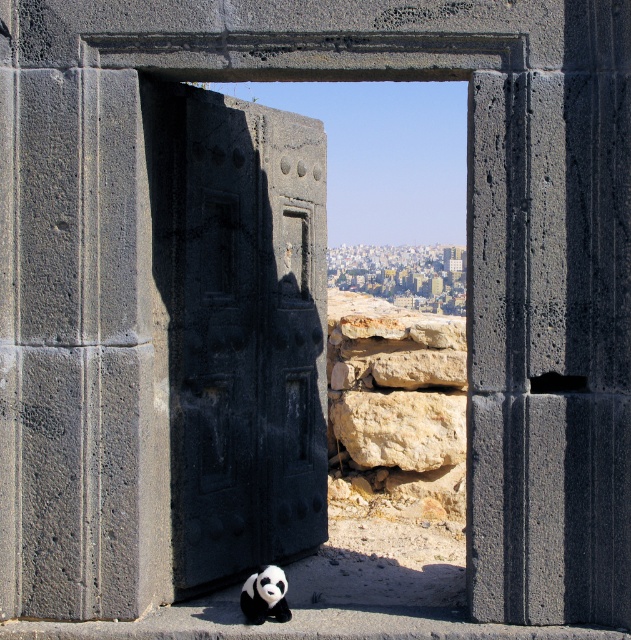
Question: Which of the following is the closest to the observer?

Choices:
 (A) (266, 180)
 (B) (271, 566)

Answer: (A)

Question: Does dark gray stone door at center have a greater width compared to black plush panda at lower center?

Choices:
 (A) yes
 (B) no

Answer: (A)

Question: Is dark gray stone door at center above black plush panda at lower center?

Choices:
 (A) yes
 (B) no

Answer: (A)

Question: Can you confirm if dark gray stone door at center is positioned to the right of black plush panda at lower center?

Choices:
 (A) yes
 (B) no

Answer: (B)